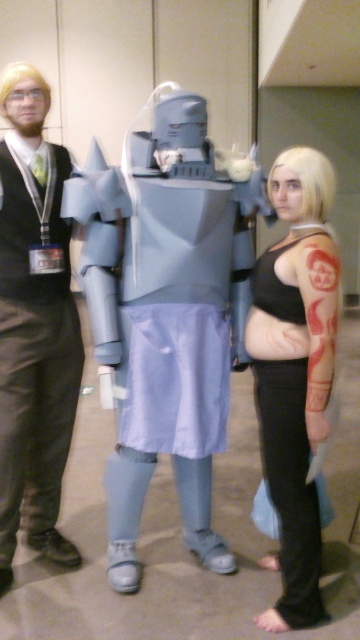
Question: Can you confirm if brushed metal vest at left is bigger than black matte tank top at center?

Choices:
 (A) yes
 (B) no

Answer: (B)

Question: Among these objects, which one is nearest to the camera?

Choices:
 (A) black matte tank top at center
 (B) brushed metal vest at left

Answer: (A)

Question: Which object appears farthest from the camera in this image?

Choices:
 (A) brushed metal vest at left
 (B) black matte tank top at center

Answer: (A)

Question: Is brushed metal vest at left to the left of black matte tank top at center from the viewer's perspective?

Choices:
 (A) yes
 (B) no

Answer: (A)

Question: Is brushed metal vest at left to the left of black matte tank top at center from the viewer's perspective?

Choices:
 (A) yes
 (B) no

Answer: (A)